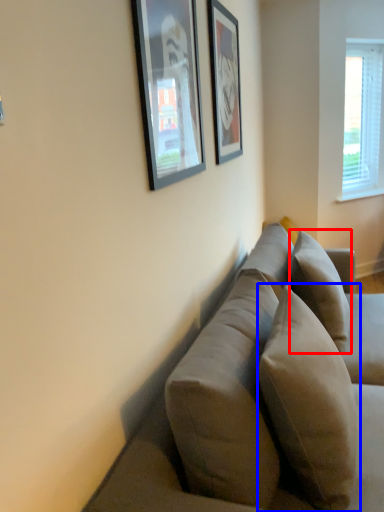
Question: Which of the following is the farthest to the observer, pillow (highlighted by a red box) or pillow (highlighted by a blue box)?

Choices:
 (A) pillow
 (B) pillow

Answer: (A)